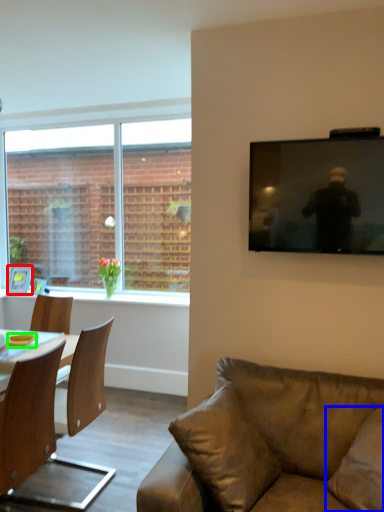
Question: Which object is the farthest from picture frame (highlighted by a red box)? Choose among these: pillow (highlighted by a blue box) or bowl (highlighted by a green box).

Choices:
 (A) pillow
 (B) bowl

Answer: (A)